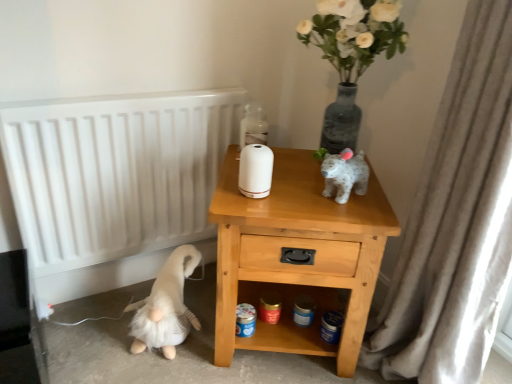
You are a GUI agent. You are given a task and a screenshot of the screen. Output one action in this format:
    pyautogui.click(x=<x>, y=<y>)
    Task: Click on the translucent glass bottle at upper center
    This screenshot has height=384, width=512.
    Given the screenshot: What is the action you would take?
    pyautogui.click(x=253, y=126)

Where is `light wood/texture nightstand at center`? The height and width of the screenshot is (384, 512). light wood/texture nightstand at center is located at coordinates (298, 249).

What is the approximate width of light wood/texture nightstand at center?

light wood/texture nightstand at center is 20.09 inches wide.

This screenshot has height=384, width=512. What do you see at coordinates (115, 172) in the screenshot?
I see `white matte radiator at left` at bounding box center [115, 172].

What do you see at coordinates (165, 306) in the screenshot? The height and width of the screenshot is (384, 512). I see `white plush gnome at lower left` at bounding box center [165, 306].

This screenshot has width=512, height=384. I want to click on white plush gnome at lower left, so (165, 306).

Image resolution: width=512 pixels, height=384 pixels. In order to click on translucent glass bottle at upper center in this screenshot , I will do `click(253, 126)`.

Between light wood/texture nightstand at center and white textured curtain at right, which one has larger size?

light wood/texture nightstand at center is bigger.

Is light wood/texture nightstand at center turned away from white textured curtain at right?

No, white textured curtain at right is not at the back of light wood/texture nightstand at center.

Does light wood/texture nightstand at center have a greater height compared to white textured curtain at right?

In fact, light wood/texture nightstand at center may be shorter than white textured curtain at right.

Which is closer to the camera, [268,325] or [471,86]?

Point [268,325] is positioned farther from the camera compared to point [471,86].

Is white matte radiator at left wider than light wood/texture nightstand at center?

In fact, white matte radiator at left might be narrower than light wood/texture nightstand at center.

Between white matte radiator at left and light wood/texture nightstand at center, which one has smaller size?

Smaller between the two is white matte radiator at left.

Considering the sizes of objects white matte radiator at left and light wood/texture nightstand at center in the image provided, who is shorter, white matte radiator at left or light wood/texture nightstand at center?

light wood/texture nightstand at center.

From a real-world perspective, is white matte radiator at left on light wood/texture nightstand at center?

Correct, in the physical world, white matte radiator at left is higher than light wood/texture nightstand at center.

Which object is wider, light wood/texture nightstand at center or white plush gnome at lower left?

light wood/texture nightstand at center.

Does light wood/texture nightstand at center come behind white plush gnome at lower left?

No, the depth of light wood/texture nightstand at center is less than that of white plush gnome at lower left.

Identify the location of animal on the left of light wood/texture nightstand at center. The height and width of the screenshot is (384, 512). tap(165, 306).

Do you think light wood/texture nightstand at center is within white plush gnome at lower left, or outside of it?

light wood/texture nightstand at center is located beyond the bounds of white plush gnome at lower left.

Is light wood/texture nightstand at center further to the viewer compared to white matte radiator at left?

No, the depth of light wood/texture nightstand at center is less than that of white matte radiator at left.

Which is behind, point (219, 223) or point (21, 153)?

The point (21, 153) is farther from the camera.

In the scene shown: Is light wood/texture nightstand at center not within white matte radiator at left?

That's correct, light wood/texture nightstand at center is outside of white matte radiator at left.

From the image's perspective, is white textured curtain at right under white matte radiator at left?

Indeed, from the image's perspective, white textured curtain at right is shown beneath white matte radiator at left.

Considering the relative sizes of white textured curtain at right and white matte radiator at left in the image provided, is white textured curtain at right smaller than white matte radiator at left?

Incorrect, white textured curtain at right is not smaller in size than white matte radiator at left.

Is point (488, 332) positioned behind point (144, 178)?

No, it is not.

In the scene shown: Considering the relative sizes of translucent glass bottle at upper center and white matte radiator at left in the image provided, is translucent glass bottle at upper center bigger than white matte radiator at left?

Actually, translucent glass bottle at upper center might be smaller than white matte radiator at left.

Who is taller, translucent glass bottle at upper center or white matte radiator at left?

Standing taller between the two is white matte radiator at left.

Considering the relative positions of translucent glass bottle at upper center and white matte radiator at left in the image provided, is translucent glass bottle at upper center to the left of white matte radiator at left from the viewer's perspective?

No.

Is translucent glass bottle at upper center next to white textured curtain at right?

No, translucent glass bottle at upper center is not in contact with white textured curtain at right.

Does point (249, 117) lie behind point (479, 243)?

Yes, it is.

Is translucent glass bottle at upper center positioned with its back to white textured curtain at right?

translucent glass bottle at upper center does not have its back to white textured curtain at right.

Image resolution: width=512 pixels, height=384 pixels. What are the coordinates of `curtain that appears above the light wood/texture nightstand at center (from a real-world perspective)` in the screenshot? It's located at (456, 220).

I want to click on nightstand in front of the white matte radiator at left, so click(298, 249).

When comparing their distances from light wood/texture nightstand at center, does white matte radiator at left or white textured curtain at right seem further?

Based on the image, white matte radiator at left appears to be further to light wood/texture nightstand at center.

Looking at the image, which one is located further to light wood/texture nightstand at center, translucent glass bottle at upper center or white matte radiator at left?

The object further to light wood/texture nightstand at center is white matte radiator at left.

Based on their spatial positions, is white plush gnome at lower left or white textured curtain at right further from white matte radiator at left?

white textured curtain at right is further to white matte radiator at left.

Considering their positions, is white plush gnome at lower left positioned closer to white matte radiator at left than translucent glass bottle at upper center?

The object closer to white matte radiator at left is white plush gnome at lower left.

Considering their positions, is white matte radiator at left positioned further to white plush gnome at lower left than white textured curtain at right?

white textured curtain at right is further to white plush gnome at lower left.

Based on their spatial positions, is light wood/texture nightstand at center or white matte radiator at left closer to translucent glass bottle at upper center?

light wood/texture nightstand at center lies closer to translucent glass bottle at upper center than the other object.

When comparing their distances from white matte radiator at left, does white textured curtain at right or white plush gnome at lower left seem closer?

The object closer to white matte radiator at left is white plush gnome at lower left.

Estimate the real-world distances between objects in this image. Which object is further from translucent glass bottle at upper center, white plush gnome at lower left or light wood/texture nightstand at center?

Among the two, white plush gnome at lower left is located further to translucent glass bottle at upper center.

Where is `bottle between white matte radiator at left and light wood/texture nightstand at center in the horizontal direction`? Image resolution: width=512 pixels, height=384 pixels. bottle between white matte radiator at left and light wood/texture nightstand at center in the horizontal direction is located at coordinates (253, 126).

The height and width of the screenshot is (384, 512). I want to click on animal between white matte radiator at left and white textured curtain at right, so click(165, 306).

Locate an element on the screen. This screenshot has width=512, height=384. nightstand between white plush gnome at lower left and white textured curtain at right in the horizontal direction is located at coordinates (298, 249).

You are a GUI agent. You are given a task and a screenshot of the screen. Output one action in this format:
    pyautogui.click(x=<x>, y=<y>)
    Task: Click on the animal between white matte radiator at left and light wood/texture nightstand at center
    
    Given the screenshot: What is the action you would take?
    pyautogui.click(x=165, y=306)